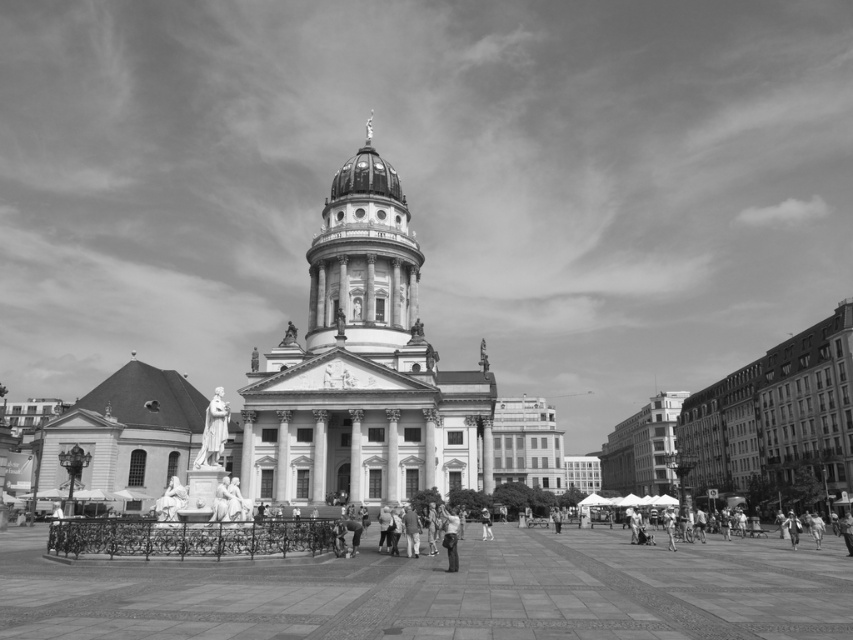
Question: Which point is closer to the camera taking this photo?

Choices:
 (A) (161, 518)
 (B) (368, 280)
 (C) (312, 481)

Answer: (A)

Question: Does white stone church at lower left appear on the left side of smooth white statue at center?

Choices:
 (A) no
 (B) yes

Answer: (B)

Question: Which of these objects is positioned closest to the smooth white column at center?

Choices:
 (A) white marble statue at center
 (B) smooth stone dome at center

Answer: (A)

Question: Is smooth white statue at center above light skin tone human at center?

Choices:
 (A) no
 (B) yes

Answer: (B)

Question: Which point appears farthest from the camera in this image?

Choices:
 (A) (448, 529)
 (B) (161, 499)
 (C) (318, 412)
 (D) (99, 410)

Answer: (D)

Question: Can you confirm if smooth white column at center is positioned to the left of smooth stone column at center?

Choices:
 (A) no
 (B) yes

Answer: (A)